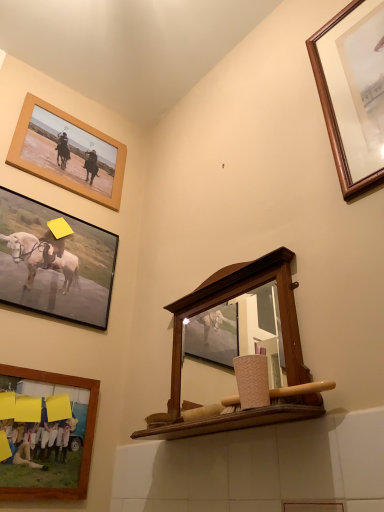
Question: Is wooden-framed picture at lower left, the third picture frame positioned from the left, thinner than wooden mirror at center?

Choices:
 (A) yes
 (B) no

Answer: (A)

Question: Is wooden-framed picture at lower left, the third picture frame positioned from the left, to the right of wooden mirror at center from the viewer's perspective?

Choices:
 (A) yes
 (B) no

Answer: (B)

Question: Is wooden-framed picture at lower left, the third picture frame positioned from the left, smaller than wooden mirror at center?

Choices:
 (A) yes
 (B) no

Answer: (A)

Question: From a real-world perspective, is wooden-framed picture at lower left, the 2th picture frame viewed from the right, beneath wooden mirror at center?

Choices:
 (A) yes
 (B) no

Answer: (A)

Question: Is wooden mirror at center surrounded by wooden-framed picture at lower left, the third picture frame positioned from the left?

Choices:
 (A) yes
 (B) no

Answer: (B)

Question: Does matte black frame at upper left, which appears as the third picture frame when viewed from the right, have a greater width compared to wooden mirror at center?

Choices:
 (A) no
 (B) yes

Answer: (A)

Question: From the image's perspective, does matte black frame at upper left, which ranks as the second picture frame in left-to-right order, appear higher than wooden mirror at center?

Choices:
 (A) no
 (B) yes

Answer: (B)

Question: Is matte black frame at upper left, which ranks as the second picture frame in left-to-right order, to the left of wooden mirror at center from the viewer's perspective?

Choices:
 (A) no
 (B) yes

Answer: (B)

Question: Is matte black frame at upper left, which appears as the third picture frame when viewed from the right, further to the viewer compared to wooden mirror at center?

Choices:
 (A) yes
 (B) no

Answer: (A)

Question: Is matte black frame at upper left, which appears as the third picture frame when viewed from the right, smaller than wooden mirror at center?

Choices:
 (A) yes
 (B) no

Answer: (A)

Question: Would you say wooden mirror at center is part of matte black frame at upper left, which ranks as the second picture frame in left-to-right order,'s contents?

Choices:
 (A) no
 (B) yes

Answer: (A)

Question: Is wooden frame at upper left, which is the fourth picture frame in right-to-left order, far away from wooden mirror at center?

Choices:
 (A) no
 (B) yes

Answer: (A)